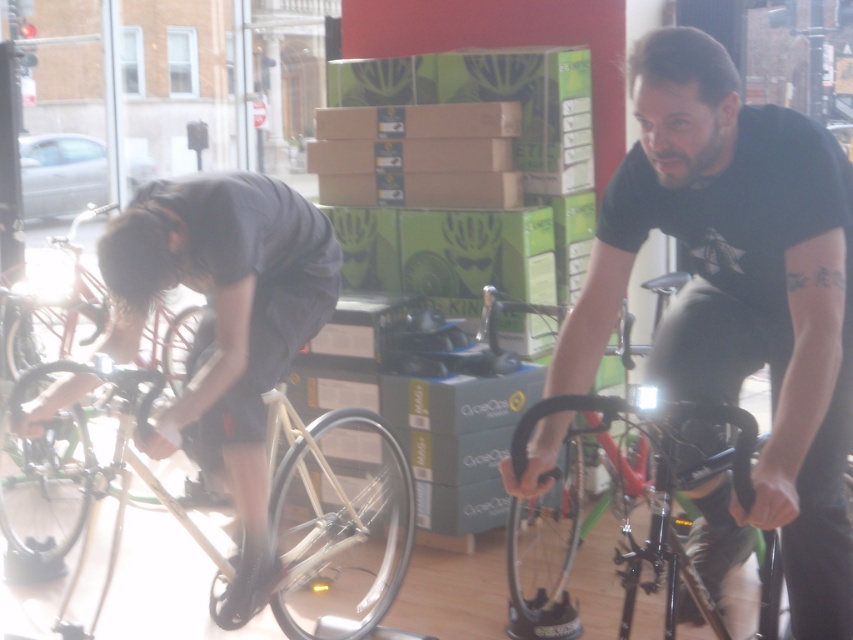
Please identify the object located at the coordinates point (341,524) in the scene described. Use the provided scene description to support your answer.

The object at point (341,524) is the wooden natural bike at center, as indicated by the coordinates provided in the Objects Description.

You are a customer who just entered the bike shop and see the dark gray fabric shirt at left and the shiny silver bicycle at left. Which object is taller?

The dark gray fabric shirt at left is much taller than the shiny silver bicycle at left.

Where is the dark gray fabric shirt at left located in the image?

The dark gray fabric shirt at left is located at the 2D coordinates point (229, 321) in the image.